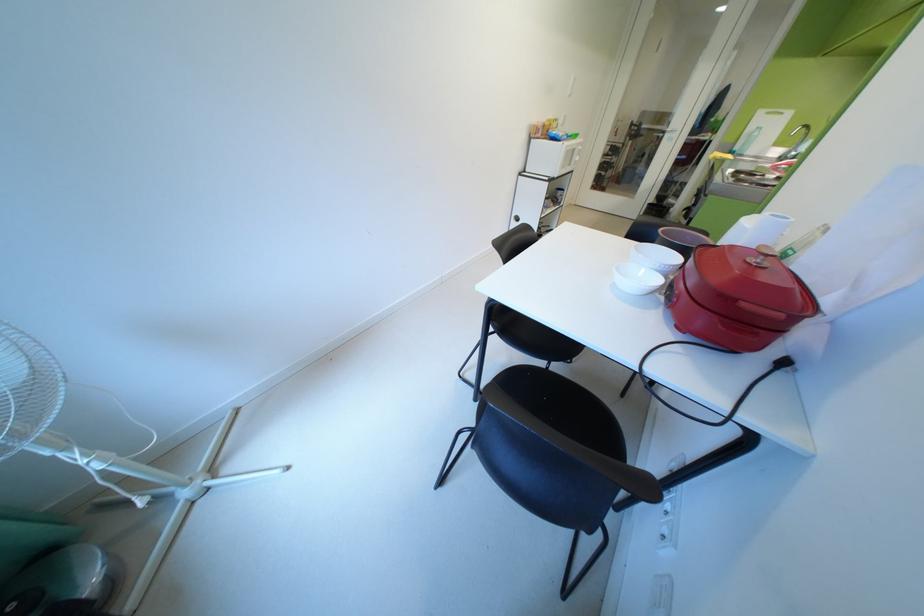
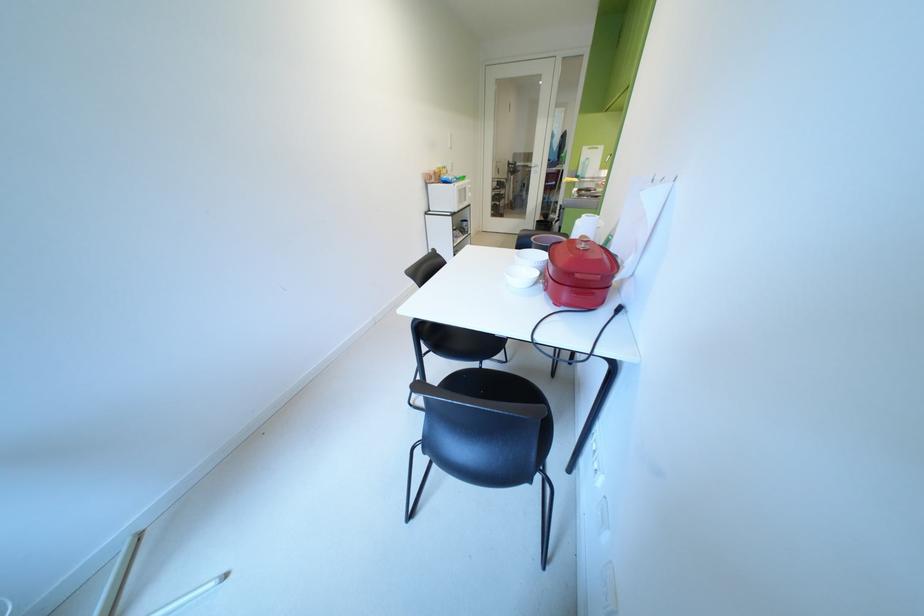
In a continuous first-person perspective shot, in which direction is the camera moving?

The cameraman walked toward right, backward.